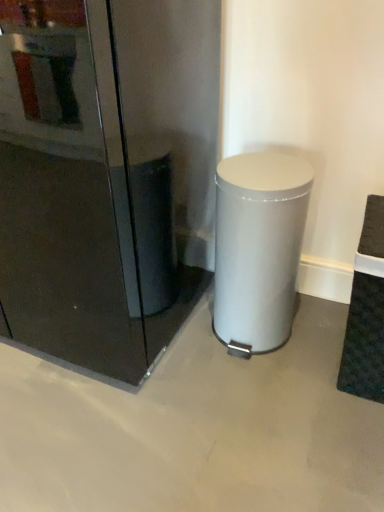
Question: From the image's perspective, is glossy black fridge at center above or below satin silver trash can at center?

Choices:
 (A) below
 (B) above

Answer: (B)

Question: From a real-world perspective, is glossy black fridge at center positioned above or below satin silver trash can at center?

Choices:
 (A) above
 (B) below

Answer: (A)

Question: From their relative heights in the image, would you say glossy black fridge at center is taller or shorter than satin silver trash can at center?

Choices:
 (A) short
 (B) tall

Answer: (B)

Question: From the image's perspective, is satin silver trash can at center located above or below glossy black fridge at center?

Choices:
 (A) below
 (B) above

Answer: (A)

Question: Is satin silver trash can at center wider or thinner than glossy black fridge at center?

Choices:
 (A) thin
 (B) wide

Answer: (A)

Question: Would you say satin silver trash can at center is to the left or to the right of glossy black fridge at center in the picture?

Choices:
 (A) right
 (B) left

Answer: (A)

Question: Is point (220, 252) positioned closer to the camera than point (198, 121)?

Choices:
 (A) farther
 (B) closer

Answer: (B)